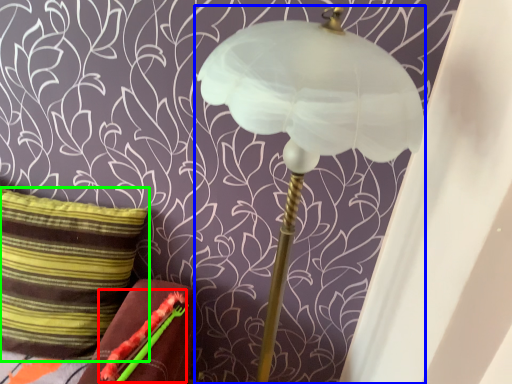
Question: Estimate the real-world distances between objects in this image. Which object is farther from flower (highlighted by a red box), lamp (highlighted by a blue box) or pillow (highlighted by a green box)?

Choices:
 (A) lamp
 (B) pillow

Answer: (A)